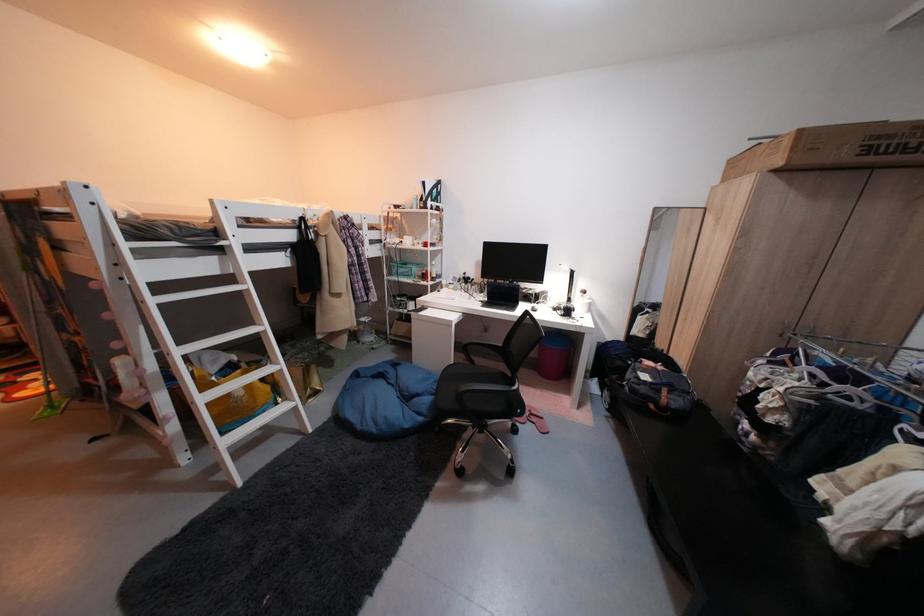
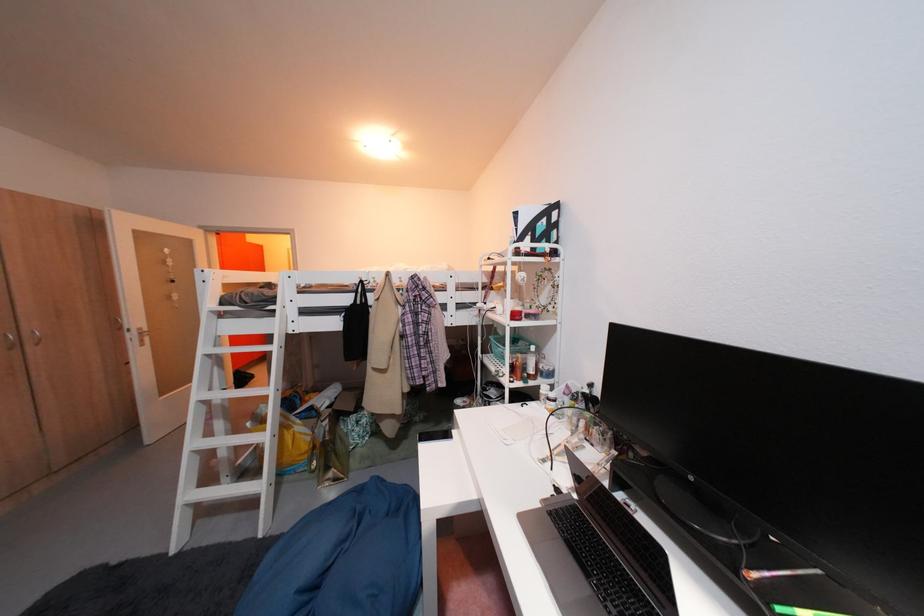
In the second image, find the point that corresponds to point 210,233 in the first image.

(276, 300)